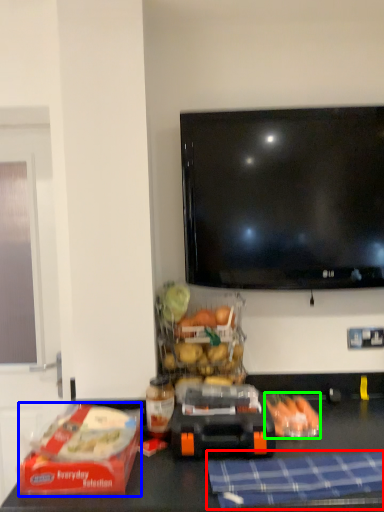
Question: Based on their relative distances, which object is farther from blanket (highlighted by a red box)? Choose from lunch box (highlighted by a blue box) and food (highlighted by a green box).

Choices:
 (A) lunch box
 (B) food

Answer: (A)